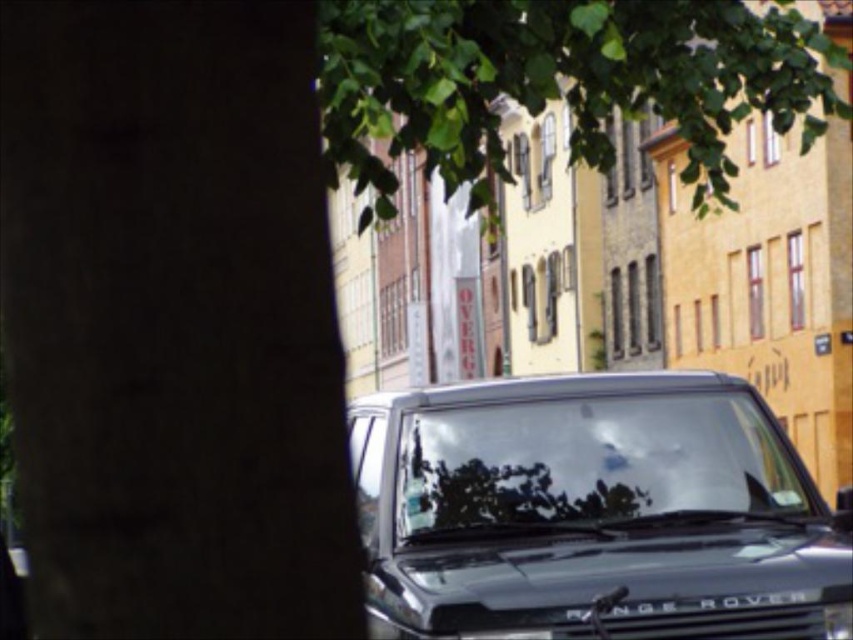
Which is above, shiny black range rover at center or green leafy tree at upper center?

green leafy tree at upper center is above.

Is point (660, 522) positioned before point (358, 58)?

No, (660, 522) is behind (358, 58).

You are a GUI agent. You are given a task and a screenshot of the screen. Output one action in this format:
    pyautogui.click(x=<x>, y=<y>)
    Task: Click on the shiny black range rover at center
    Image resolution: width=853 pixels, height=640 pixels.
    Given the screenshot: What is the action you would take?
    coord(592,513)